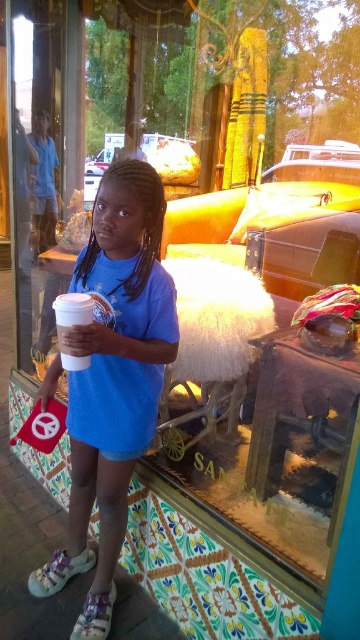
Does point (104, 568) lie behind point (68, 294)?

Yes, point (104, 568) is behind point (68, 294).

The image size is (360, 640). In order to click on blue matte shirt at center in this screenshot , I will do (114, 380).

Identify the location of blue matte shirt at center. (114, 380).